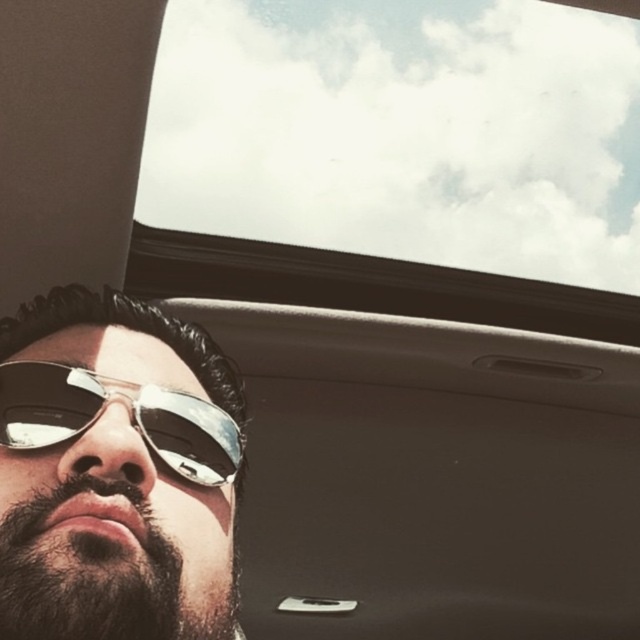
You are sitting in the driver seat of the car shown in the image. You want to adjust the sunroof using the handle near the center of the ceiling. To reach the handle, you need to move your hand from the dark brown fuzzy beard at lower left. In which direction should you move your hand relative to the beard?

To reach the sunroof handle near the center of the ceiling from the dark brown fuzzy beard at lower left, you should move your hand upward and toward the center of the car. The handle is located at the center of the ceiling, while the beard is positioned at the lower left corner, so moving upward and towards the middle would align your hand with the handle.

You are sitting in the back seat of the car and want to look at the sky through the transparent glass car window at upper center without being distracted by the metallic reflective sunglasses at lower left. Can you do that?

The transparent glass car window at upper center is located above the metallic reflective sunglasses at lower left, so you can look at the sky through the transparent glass car window at upper center without being distracted by the metallic reflective sunglasses at lower left.